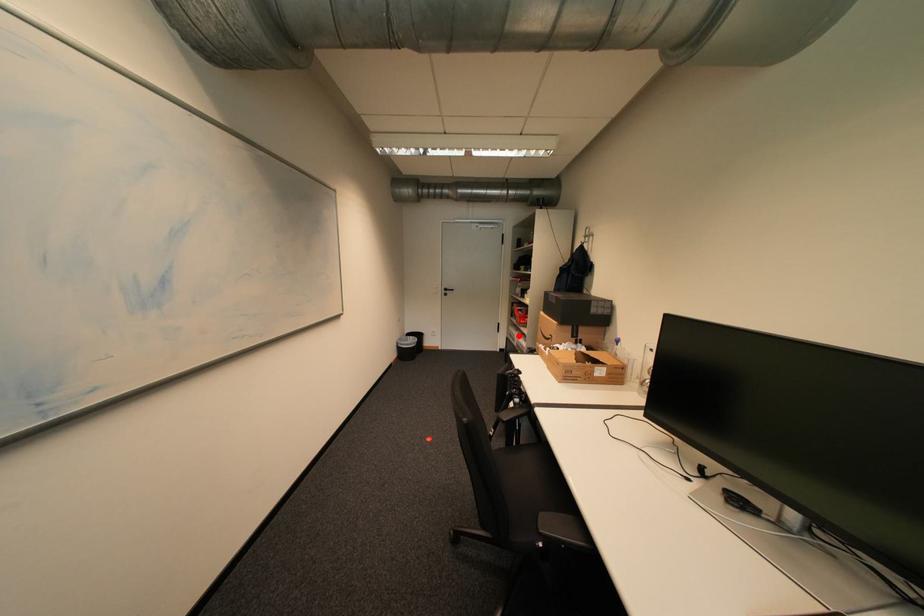
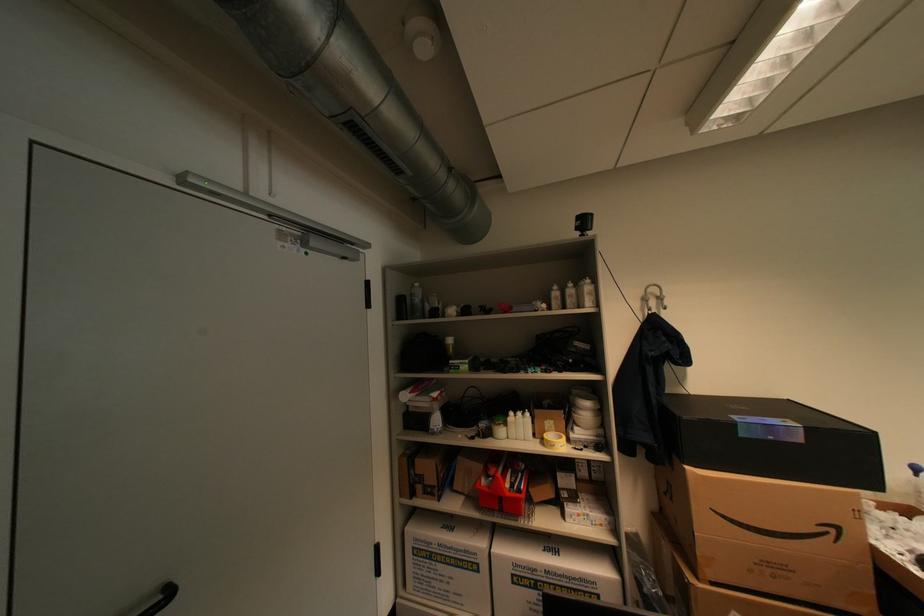
The point at the highlighted location is marked in the first image. Where is the corresponding point in the second image?

(439, 556)